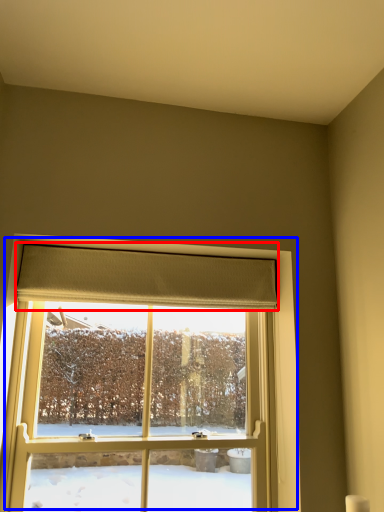
Question: Among these objects, which one is farthest to the camera, curtain (highlighted by a red box) or window (highlighted by a blue box)?

Choices:
 (A) curtain
 (B) window

Answer: (A)